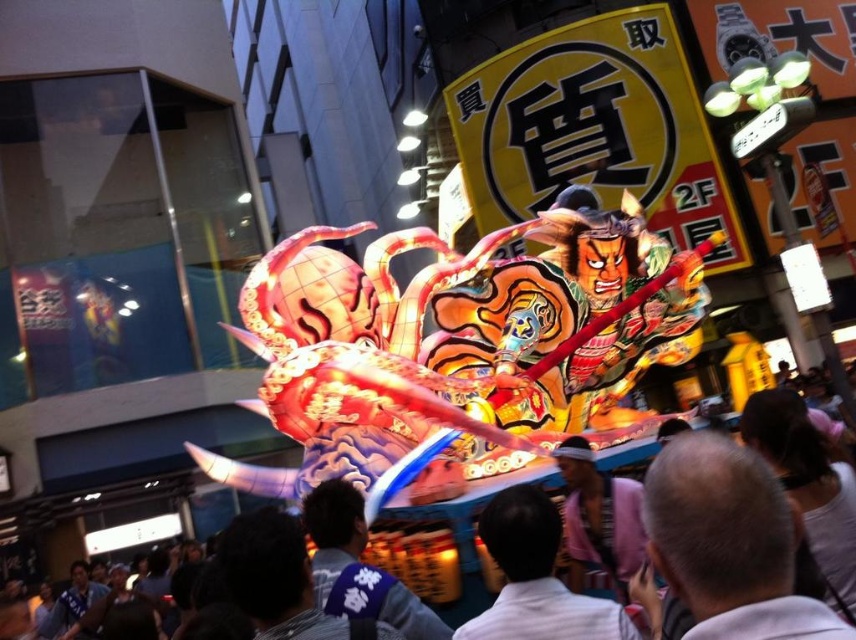
You are a photographer trying to capture the central float during the festival. You notice two elements in your frame, the dark blue fabric at center and the silky fabric crowd at center. Which of these elements takes up more visual space in the image?

The silky fabric crowd at center occupies more visual space than the dark blue fabric at center.

You are a photographer standing in front of the float during the festival. You want to take a photo that captures both the dark blue fabric at center and the silky fabric crowd at center. Which fabric will appear closer to you in the photo?

The dark blue fabric at center will appear closer to you in the photo because it is positioned further to the viewer than the silky fabric crowd at center.

Consider the image. You are a photographer trying to capture the festival float. You notice the dark blue fabric at center and the silky fabric crowd at center. Which fabric is located to the right of the other?

The dark blue fabric at center is positioned on the right side of silky fabric crowd at center.